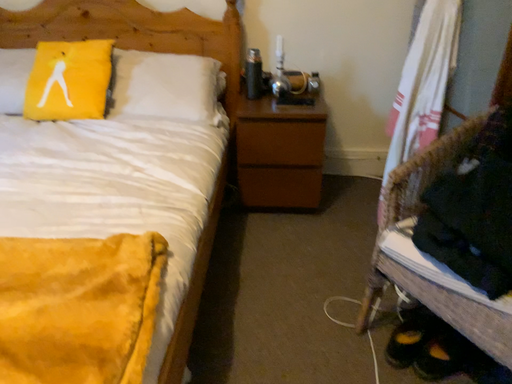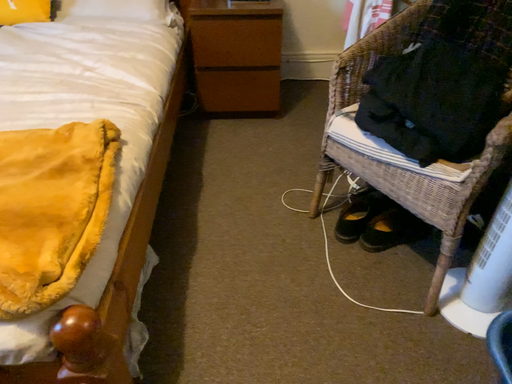
Question: Which way did the camera rotate in the video?

Choices:
 (A) rotated upward
 (B) rotated downward

Answer: (B)